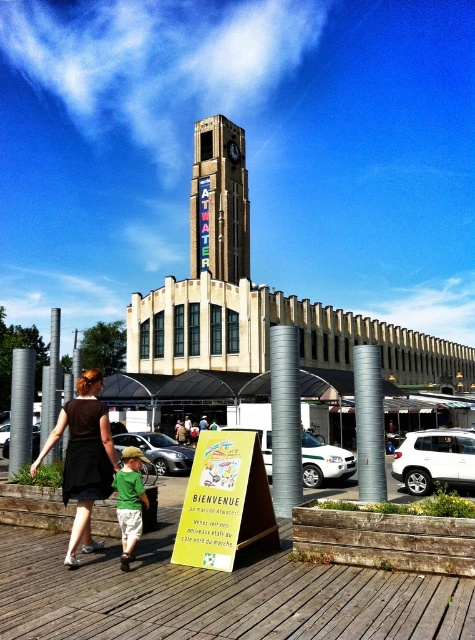
Can you confirm if matte black dress at center is taller than green cotton shirt at lower left?

Indeed, matte black dress at center has a greater height compared to green cotton shirt at lower left.

Does point (83, 548) come farther from viewer compared to point (123, 481)?

Yes, it is.

In order to click on matte black dress at center in this screenshot , I will do `click(84, 458)`.

Can you confirm if green cotton shirt at lower left is positioned to the left of metallic clock face at center?

Correct, you'll find green cotton shirt at lower left to the left of metallic clock face at center.

Is green cotton shirt at lower left bigger than metallic clock face at center?

Actually, green cotton shirt at lower left might be smaller than metallic clock face at center.

The width and height of the screenshot is (475, 640). What do you see at coordinates (130, 500) in the screenshot? I see `green cotton shirt at lower left` at bounding box center [130, 500].

The height and width of the screenshot is (640, 475). In order to click on green cotton shirt at lower left in this screenshot , I will do `click(130, 500)`.

Can you confirm if matte black dress at center is positioned to the right of metallic clock face at center?

Incorrect, matte black dress at center is not on the right side of metallic clock face at center.

Between matte black dress at center and metallic clock face at center, which one has less height?

With less height is metallic clock face at center.

Which is behind, point (72, 444) or point (235, 157)?

Positioned behind is point (235, 157).

The width and height of the screenshot is (475, 640). I want to click on matte black dress at center, so click(84, 458).